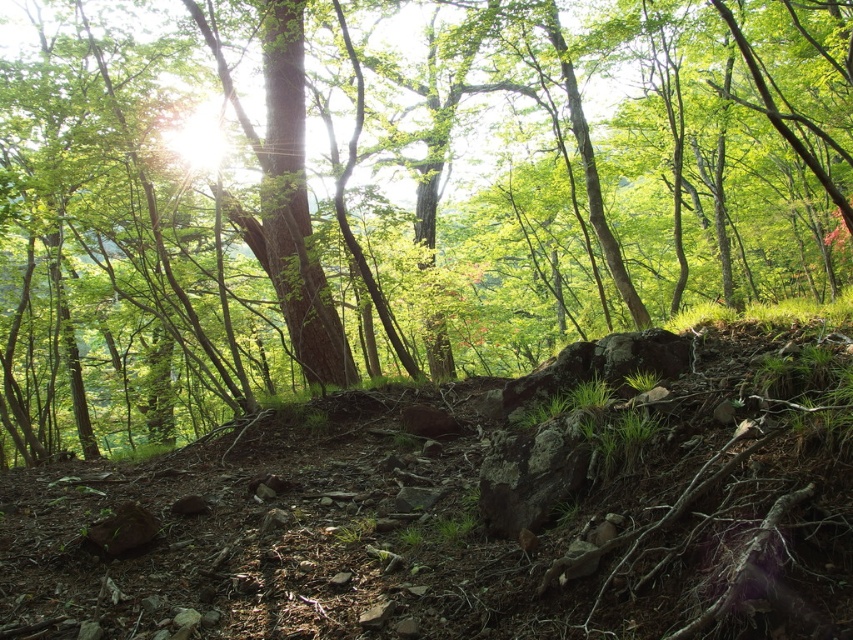
Which is above, green matte tree at center or dull brown dirt at center?

Positioned higher is green matte tree at center.

Is point (415, 257) in front of point (843, 458)?

No, (415, 257) is further to viewer.

Which is in front, point (817, 86) or point (456, 516)?

Point (456, 516) is in front.

Where is `green matte tree at center`? green matte tree at center is located at coordinates (387, 196).